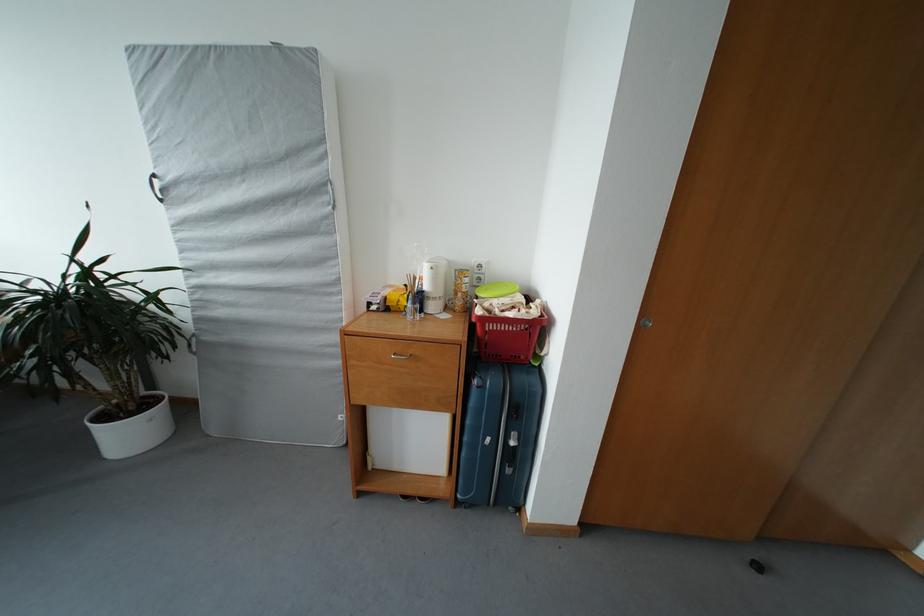
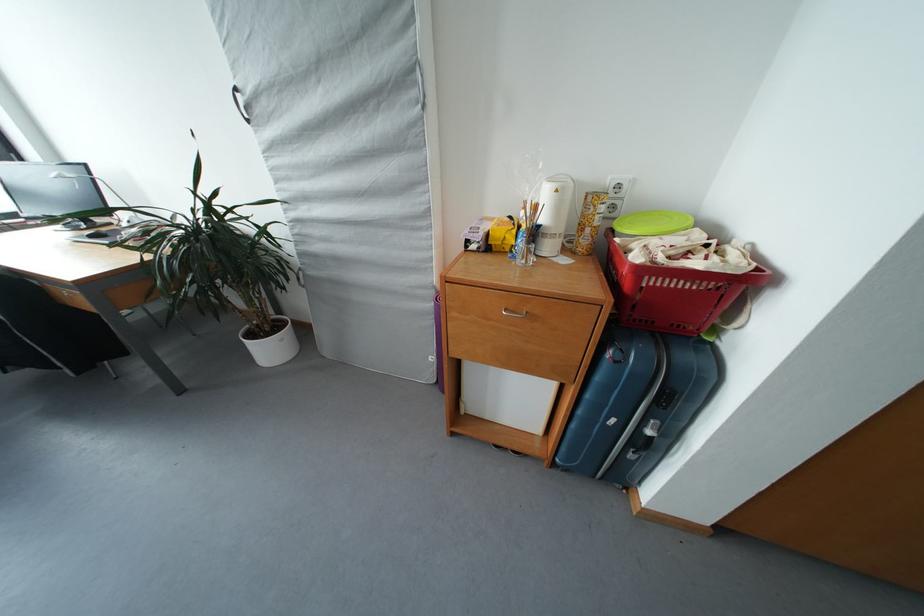
In the second image, find the point that corresponds to (439,273) in the first image.

(563, 196)